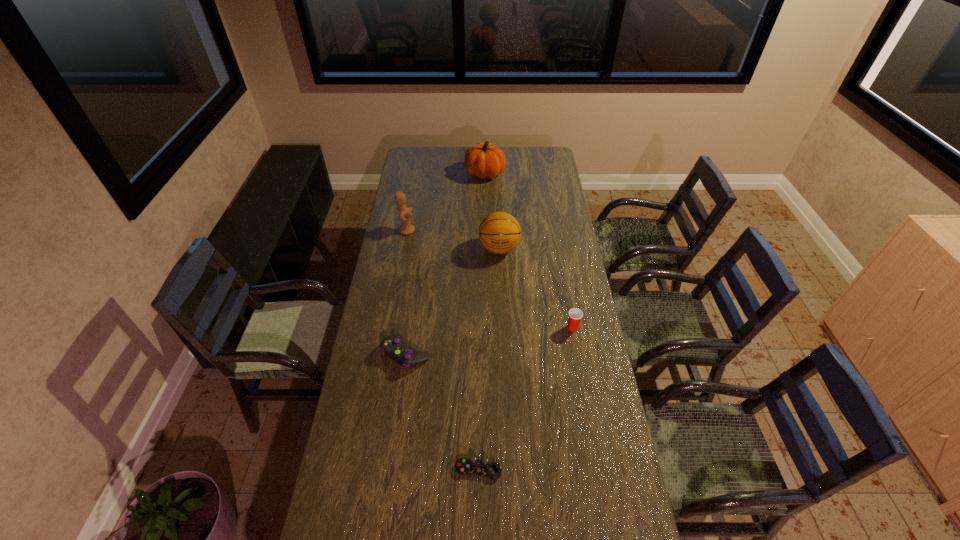
Identify the location of figurine. The width and height of the screenshot is (960, 540). (406, 228).

Where is `the farthest object`? The width and height of the screenshot is (960, 540). the farthest object is located at coordinates (483, 160).

Identify the location of basketball. (499, 232).

Where is `the rightmost object`? the rightmost object is located at coordinates (575, 315).

Find the location of a particular element. Dixie cup is located at coordinates 575,315.

The height and width of the screenshot is (540, 960). Identify the location of the left control. (401, 353).

You are a GUI agent. You are given a task and a screenshot of the screen. Output one action in this format:
    pyautogui.click(x=<x>, y=<y>)
    Task: Click on the taller control
    
    Given the screenshot: What is the action you would take?
    pyautogui.click(x=401, y=353)

This screenshot has width=960, height=540. I want to click on the shortest object, so click(463, 466).

I want to click on the right control, so click(x=463, y=466).

Identify the location of vacant position located 0.170m on the front-facing side of the figurine. (449, 230).